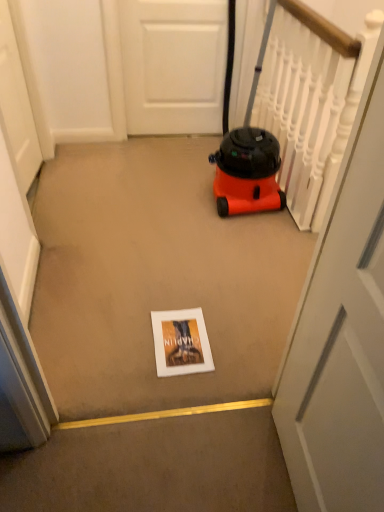
At what (x,y) coordinates should I click in order to perform the action: click on free point above matte white book at center (from a real-world perspective). Please return your answer as a coordinate pair (x, y). Looking at the image, I should click on click(169, 336).